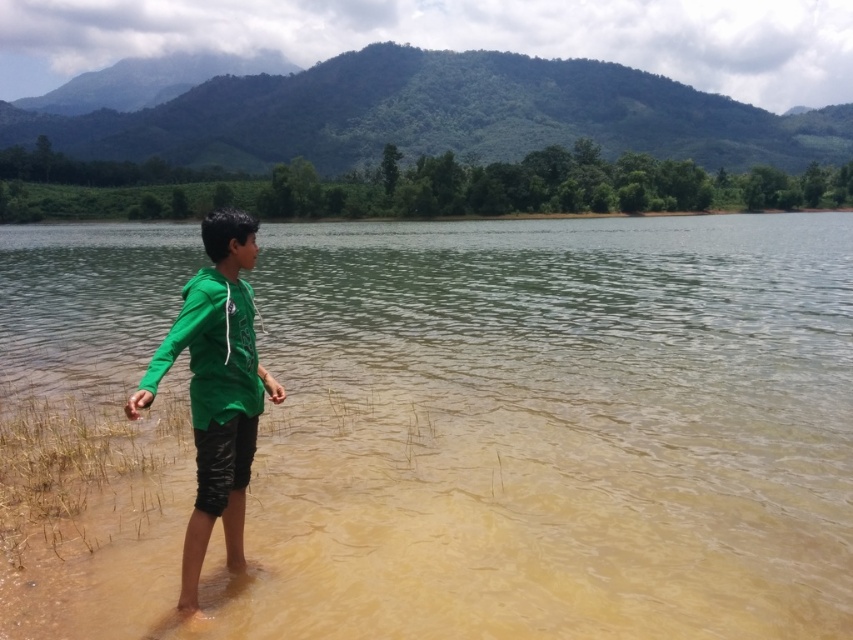
You are planning to take a photo of the scene. The brown muddy water at center and the green matte hoodie at center are both in the frame. Which object occupies more space in the photo?

The brown muddy water at center is larger in size than the green matte hoodie at center, so it occupies more space in the photo.

You are a safety officer inspecting the scene. The brown muddy water at center and the green matte hoodie at center are both in the image. Which object is positioned higher from the ground?

The brown muddy water at center is above the green matte hoodie at center, so it is positioned higher from the ground.